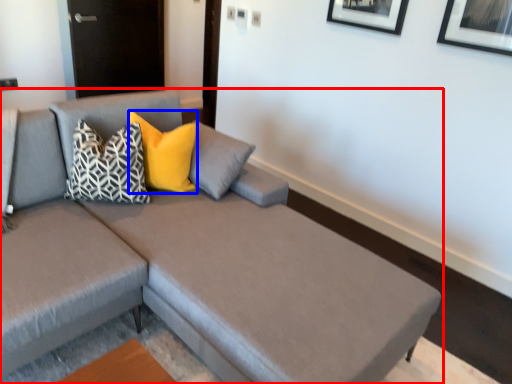
Question: Among these objects, which one is farthest to the camera, studio couch (highlighted by a red box) or pillow (highlighted by a blue box)?

Choices:
 (A) studio couch
 (B) pillow

Answer: (B)